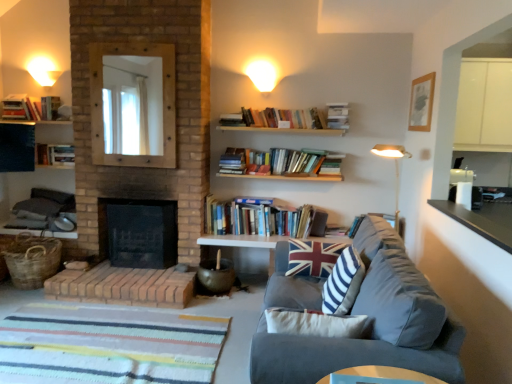
What are the coordinates of `free region under wooden mirror at upper left (from a real-world perspective)` in the screenshot? It's located at (129, 204).